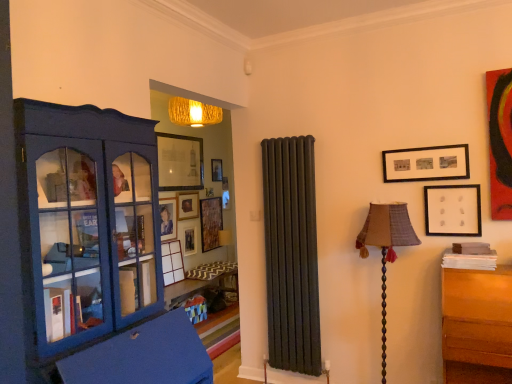
Question: Which direction should I rotate to face matte wooden picture frame at center, positioned as the 7th picture frame in right-to-left order, — up or down?

Choices:
 (A) down
 (B) up

Answer: (A)

Question: From a real-world perspective, is white matte picture frame at upper right, the 1th picture frame when ordered from right to left, located beneath wooden picture frame at left, which ranks as the fourth picture frame in front-to-back order?

Choices:
 (A) yes
 (B) no

Answer: (B)

Question: Considering the relative sizes of white matte picture frame at upper right, the 1th picture frame when ordered from right to left, and wooden picture frame at left, which ranks as the fourth picture frame in front-to-back order, in the image provided, is white matte picture frame at upper right, the 1th picture frame when ordered from right to left, thinner than wooden picture frame at left, which ranks as the fourth picture frame in front-to-back order,?

Choices:
 (A) yes
 (B) no

Answer: (A)

Question: From the image's perspective, is white matte picture frame at upper right, the first picture frame from the front, below wooden picture frame at left, the fourth picture frame when ordered from back to front?

Choices:
 (A) yes
 (B) no

Answer: (B)

Question: Is white matte picture frame at upper right, the 7th picture frame when ordered from left to right, not close to wooden picture frame at left, which is the fifth picture frame from right to left?

Choices:
 (A) no
 (B) yes

Answer: (B)

Question: Can you confirm if white matte picture frame at upper right, the first picture frame from the front, is positioned to the left of wooden picture frame at left, which is the fifth picture frame from right to left?

Choices:
 (A) no
 (B) yes

Answer: (A)

Question: Is white matte picture frame at upper right, the 1th picture frame when ordered from right to left, further to the viewer compared to wooden picture frame at left, the fourth picture frame when ordered from back to front?

Choices:
 (A) yes
 (B) no

Answer: (B)

Question: Can you confirm if matte blue cabinet at left is shorter than white matte picture frame at upper right, the first picture frame from the front?

Choices:
 (A) yes
 (B) no

Answer: (B)

Question: Is matte blue cabinet at left facing away from white matte picture frame at upper right, the 1th picture frame when ordered from right to left?

Choices:
 (A) yes
 (B) no

Answer: (B)

Question: Is matte blue cabinet at left not close to white matte picture frame at upper right, the first picture frame from the front?

Choices:
 (A) yes
 (B) no

Answer: (A)

Question: Does matte blue cabinet at left have a lesser width compared to white matte picture frame at upper right, which is the 7th picture frame in back-to-front order?

Choices:
 (A) no
 (B) yes

Answer: (A)

Question: Could white matte picture frame at upper right, the 7th picture frame when ordered from left to right, be considered to be inside matte blue cabinet at left?

Choices:
 (A) no
 (B) yes

Answer: (A)

Question: Can you confirm if matte blue cabinet at left is positioned to the right of white matte picture frame at upper right, the 7th picture frame when ordered from left to right?

Choices:
 (A) no
 (B) yes

Answer: (A)

Question: Is textured fabric lampshade at right far from matte blue cabinet at left?

Choices:
 (A) no
 (B) yes

Answer: (B)